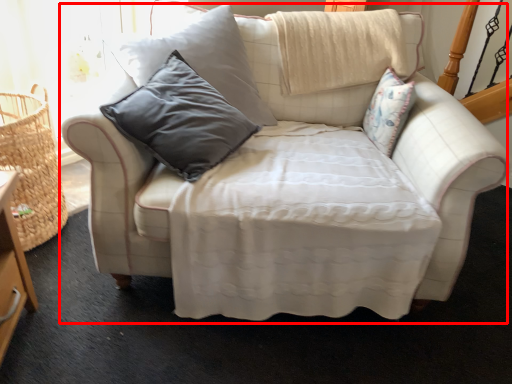
Question: Observing the image, what is the correct spatial positioning of studio couch (annotated by the red box) in reference to basket?

Choices:
 (A) right
 (B) left

Answer: (A)